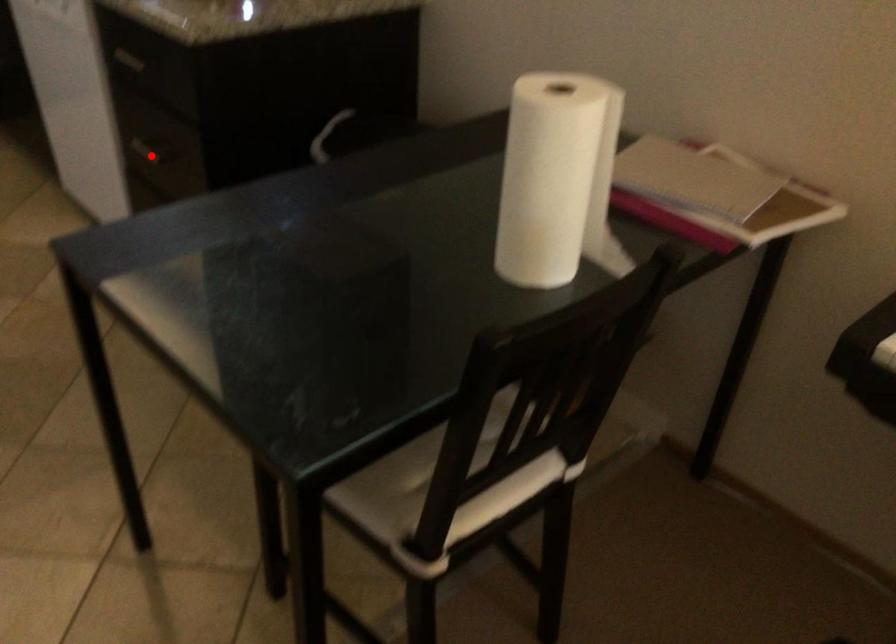
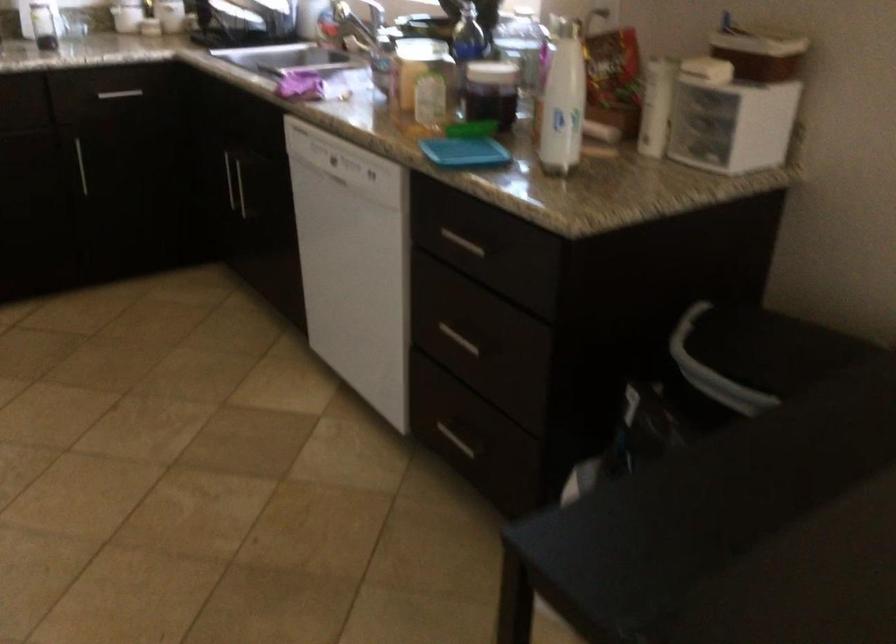
Question: I am providing you with two images of the same scene from different viewpoints. Image1 has a red point marked. In image2, the corresponding 3D location appears at what relative position? Reply with the corresponding letter.

Choices:
 (A) Closer
 (B) Farther

Answer: (A)